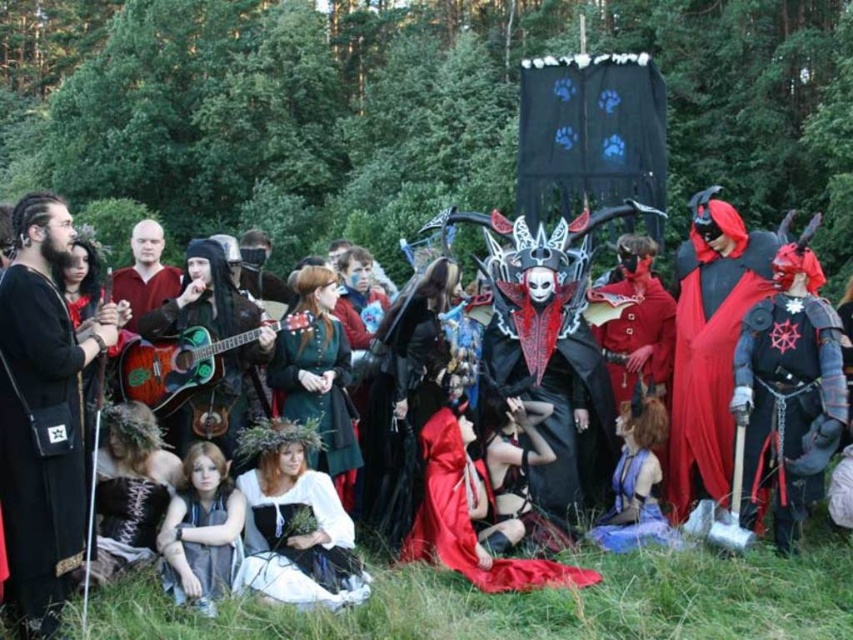
Is shiny blue fabric dress at lower center further to the viewer compared to smooth red shirt at center?

That is True.

Is shiny blue fabric dress at lower center thinner than smooth red shirt at center?

Yes.

Is point (627, 477) positioned before point (158, 250)?

Yes, it is.

Where is `shiny blue fabric dress at lower center`? The height and width of the screenshot is (640, 853). shiny blue fabric dress at lower center is located at coordinates (634, 506).

Is metallic armor at center smaller than velvet red dress at center?

Indeed, metallic armor at center has a smaller size compared to velvet red dress at center.

Between point (779, 378) and point (426, 436), which one is positioned in front?

Positioned in front is point (779, 378).

Does point (843, 388) come closer to viewer compared to point (454, 440)?

Yes, point (843, 388) is in front of point (454, 440).

You are a GUI agent. You are given a task and a screenshot of the screen. Output one action in this format:
    pyautogui.click(x=<x>, y=<y>)
    Task: Click on the metallic armor at center
    
    Given the screenshot: What is the action you would take?
    pyautogui.click(x=787, y=404)

In the scene shown: Who is higher up, matte black mask at center or velvet red dress at center?

matte black mask at center is above.

Consider the image. Measure the distance from matte black mask at center to velvet red dress at center.

matte black mask at center and velvet red dress at center are 3.11 meters apart from each other.

Who is more distant from viewer, (x=398, y=598) or (x=457, y=472)?

Point (x=457, y=472)

Where is `matte black mask at center`? This screenshot has width=853, height=640. matte black mask at center is located at coordinates (543, 602).